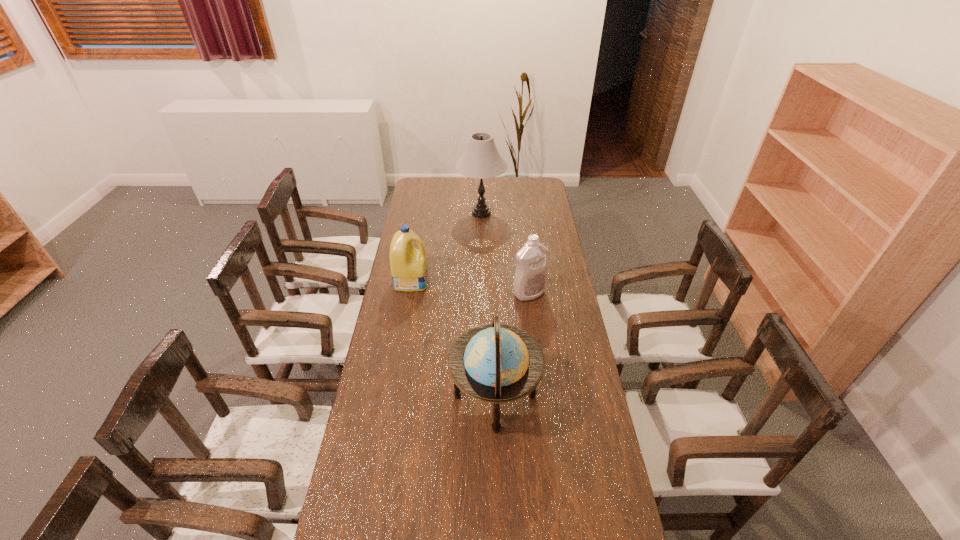
This screenshot has height=540, width=960. Identify the location of vacant space that's between the nearest object and the farthest object. (488, 305).

Where is `free space between the tallest object and the right detergent`? This screenshot has height=540, width=960. free space between the tallest object and the right detergent is located at coordinates (505, 253).

This screenshot has height=540, width=960. What are the coordinates of `vacant space in between the leftmost object and the farthest object` in the screenshot? It's located at (446, 247).

This screenshot has width=960, height=540. I want to click on object that stands as the third closest to the right detergent, so click(x=481, y=160).

This screenshot has width=960, height=540. What are the coordinates of `the third closest object to the leftmost object` in the screenshot? It's located at tap(496, 356).

Identify the location of the closest detergent relative to the farthest object. Image resolution: width=960 pixels, height=540 pixels. (409, 268).

You are a GUI agent. You are given a task and a screenshot of the screen. Output one action in this format:
    pyautogui.click(x=<x>, y=<y>)
    Task: Click on the detergent that is the closest to the lamp
    The width and height of the screenshot is (960, 540).
    Given the screenshot: What is the action you would take?
    pyautogui.click(x=409, y=268)

In order to click on free space that satisfies the following two spatial constraints: 1. on the label of the left detergent; 2. on the left side of the right detergent in this screenshot , I will do `click(410, 293)`.

Find the location of a particular element. This screenshot has height=540, width=960. vacant space that satisfies the following two spatial constraints: 1. on the front side of the right detergent; 2. on the surface of the nearest object is located at coordinates (541, 396).